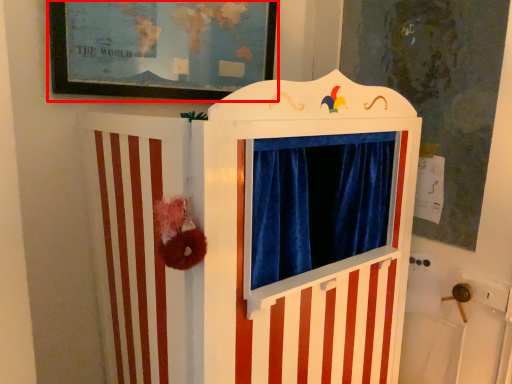
Question: From the image's perspective, where is picture frame (annotated by the red box) located in relation to furniture in the image?

Choices:
 (A) below
 (B) above

Answer: (B)